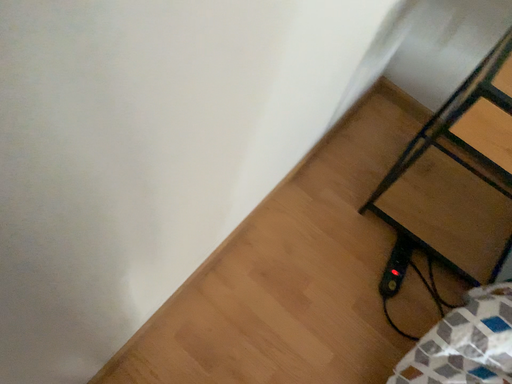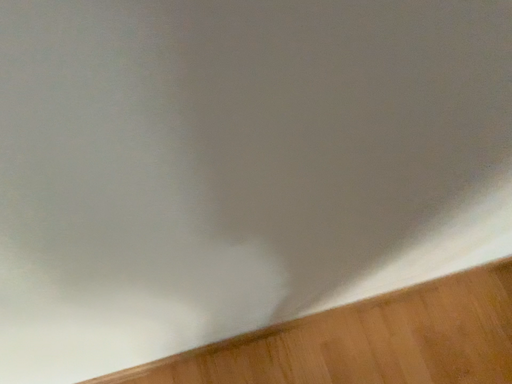
Question: Which way did the camera rotate in the video?

Choices:
 (A) rotated upward
 (B) rotated downward

Answer: (A)